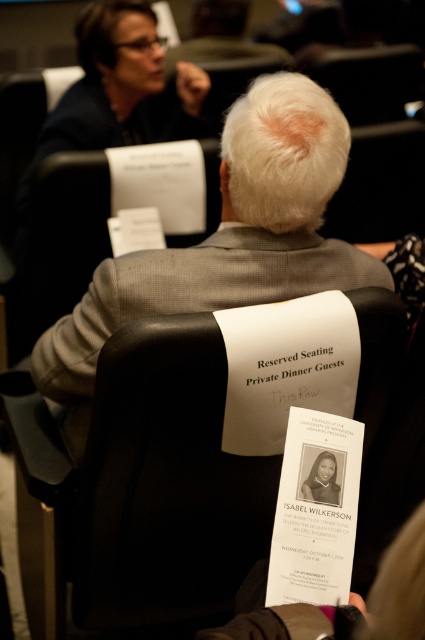
Does black leather chair at center have a lesser height compared to gray woolen suit at center?

Correct, black leather chair at center is not as tall as gray woolen suit at center.

Is point (73, 582) more distant than point (226, 307)?

Yes.

Where is `black leather chair at center`? black leather chair at center is located at coordinates (153, 481).

Where is `black leather chair at center`? black leather chair at center is located at coordinates (153, 481).

Measure the distance between black leather chair at center and black paper brochure at center.

10.38 inches

Consider the image. Is black leather chair at center to the left of black paper brochure at center from the viewer's perspective?

Indeed, black leather chair at center is positioned on the left side of black paper brochure at center.

Between point (257, 532) and point (303, 429), which one is positioned in front?

Positioned in front is point (303, 429).

Where is `black leather chair at center`? The height and width of the screenshot is (640, 425). black leather chair at center is located at coordinates (153, 481).

Who is taller, gray woolen suit at center or black paper brochure at center?

Standing taller between the two is gray woolen suit at center.

Is point (277, 144) in front of point (345, 467)?

No, (277, 144) is behind (345, 467).

Is point (65, 385) less distant than point (286, 483)?

No, it is not.

The image size is (425, 640). Find the location of `gray woolen suit at center`. gray woolen suit at center is located at coordinates (224, 241).